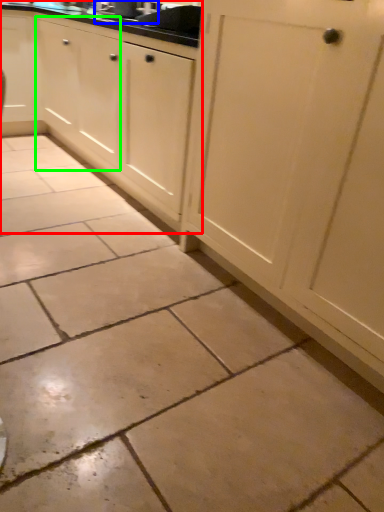
Question: Which object is positioned farthest from cabinetry (highlighted by a red box)? Select from sink (highlighted by a blue box) and cabinetry (highlighted by a green box).

Choices:
 (A) sink
 (B) cabinetry

Answer: (A)